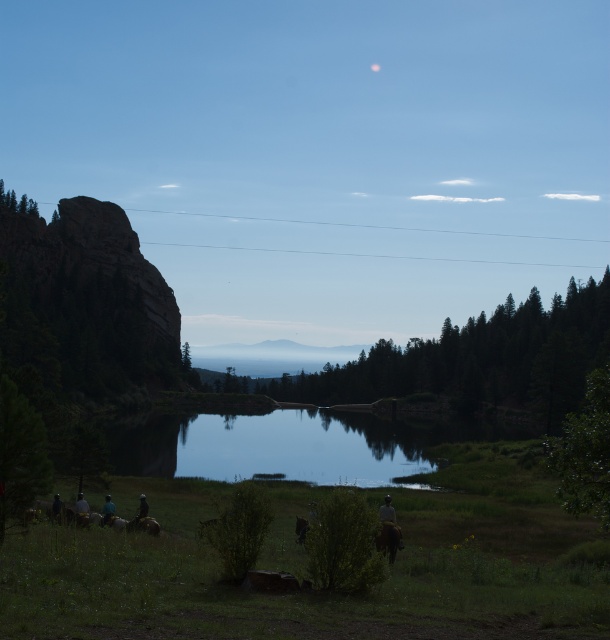
Question: Which point appears farthest from the camera in this image?

Choices:
 (A) (605, 509)
 (B) (500, 378)
 (C) (104, 513)

Answer: (B)

Question: Is the position of green fabric shirt at lower left more distant than that of green matte tree at center?

Choices:
 (A) yes
 (B) no

Answer: (B)

Question: Observing the image, what is the correct spatial positioning of green leafy bush at center in reference to green matte tree at lower left?

Choices:
 (A) left
 (B) right

Answer: (B)

Question: Is green leafy tree at right positioned at the back of green fabric shirt at lower left?

Choices:
 (A) yes
 (B) no

Answer: (B)

Question: Estimate the real-world distances between objects in this image. Which object is farther from the dark blue fabric rider at lower left?

Choices:
 (A) dark gray fabric jacket at lower left
 (B) smooth glass water at center
 (C) green textured tree at center
 (D) green fabric shirt at lower left

Answer: (C)

Question: Which point is closer to the camera?

Choices:
 (A) green fabric shirt at lower left
 (B) dark blue fabric rider at lower left
 (C) white cotton shirt at lower center

Answer: (C)